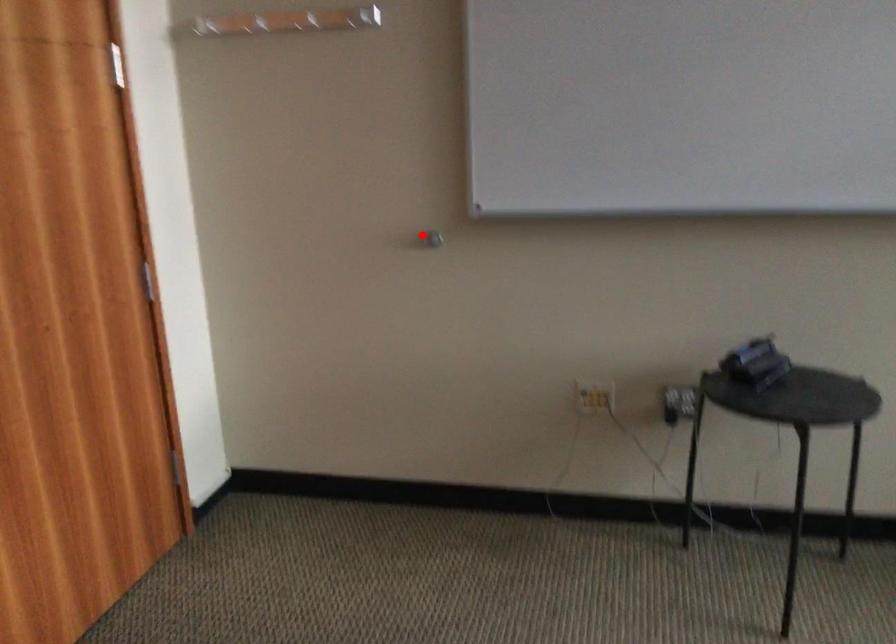
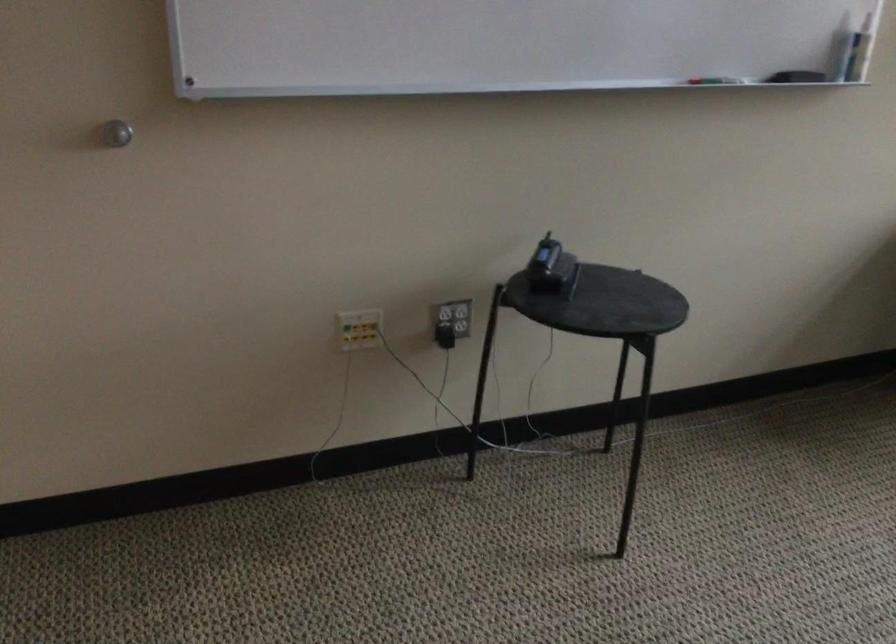
Question: I am providing you with two images of the same scene from different viewpoints. Image1 has a red point marked. In image2, the corresponding 3D location appears at what relative position? Reply with the corresponding letter.

Choices:
 (A) Closer
 (B) Farther

Answer: (A)